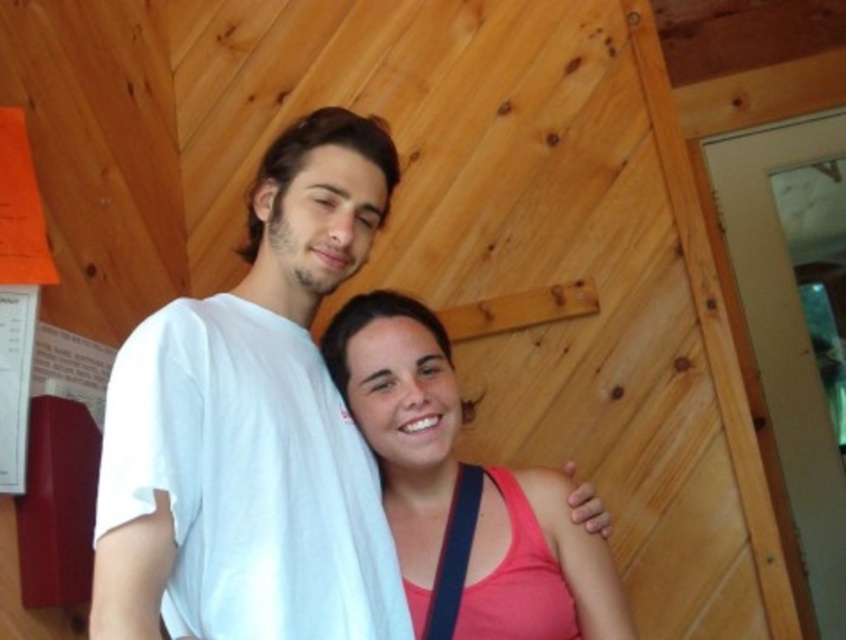
Can you confirm if white cotton shirt at center is positioned to the right of pink matte tank top at center?

No, white cotton shirt at center is not to the right of pink matte tank top at center.

Is white cotton shirt at center further to camera compared to pink matte tank top at center?

No.

The image size is (846, 640). What do you see at coordinates (253, 428) in the screenshot? I see `white cotton shirt at center` at bounding box center [253, 428].

This screenshot has height=640, width=846. Find the location of `white cotton shirt at center`. white cotton shirt at center is located at coordinates (253, 428).